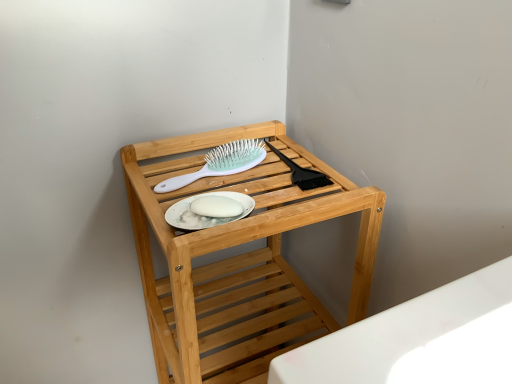
You are a GUI agent. You are given a task and a screenshot of the screen. Output one action in this format:
    pyautogui.click(x=<x>, y=<y>)
    Task: Click on the free space to the right of white matte platter at center
    
    Given the screenshot: What is the action you would take?
    pyautogui.click(x=297, y=211)